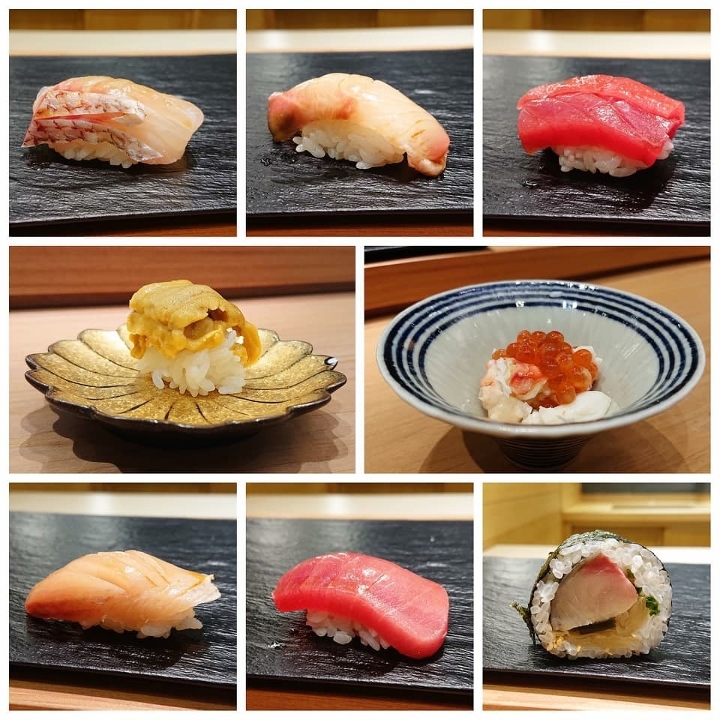
Find the location of a particular element. The image size is (720, 720). wood table is located at coordinates (395, 436), (325, 450).